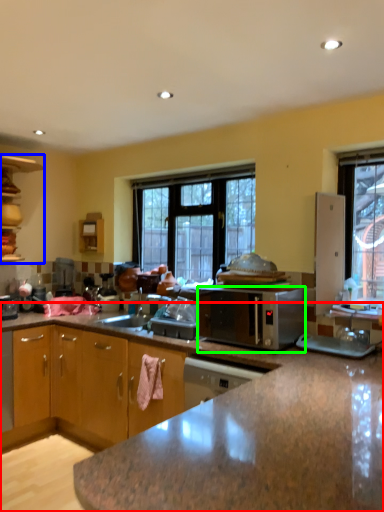
Question: Which object is the farthest from cabinetry (highlighted by a red box)? Choose among these: cabinetry (highlighted by a blue box) or microwave oven (highlighted by a green box).

Choices:
 (A) cabinetry
 (B) microwave oven

Answer: (A)